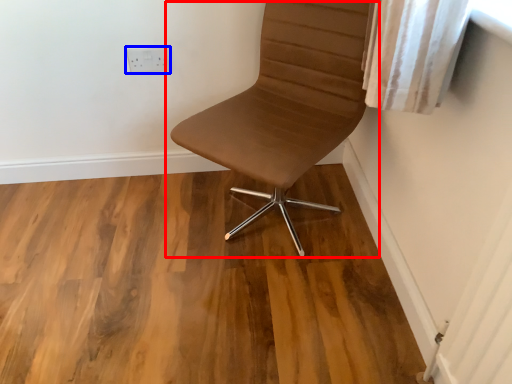
Question: Which of the following is the farthest to the observer, chair (highlighted by a red box) or electric outlet (highlighted by a blue box)?

Choices:
 (A) chair
 (B) electric outlet

Answer: (B)